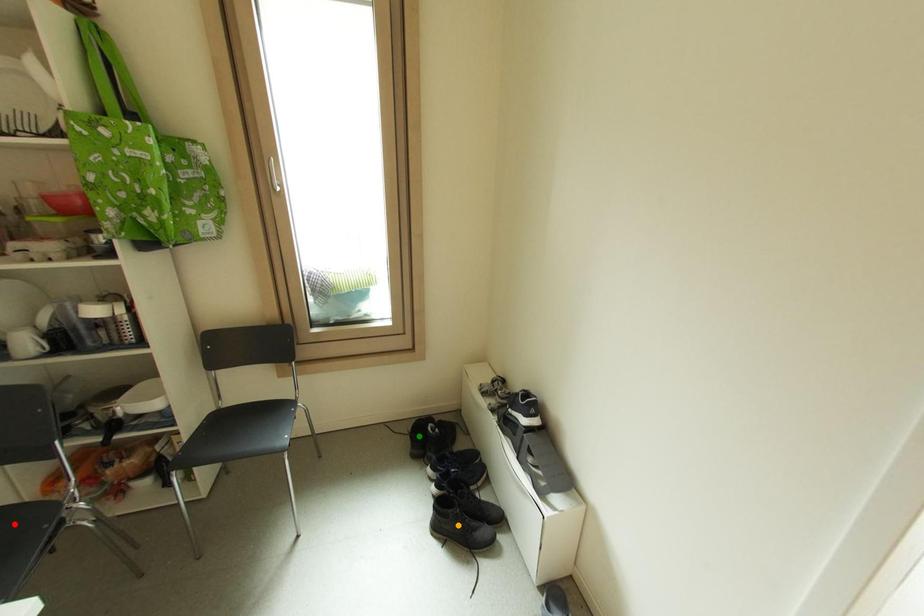
Order these from nearest to farthest:
- green point
- orange point
- red point

red point → orange point → green point